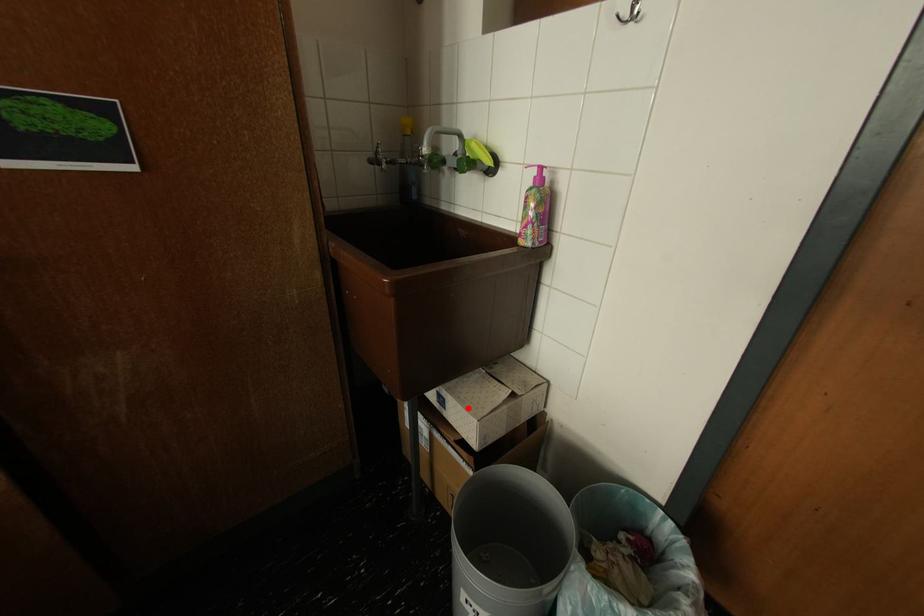
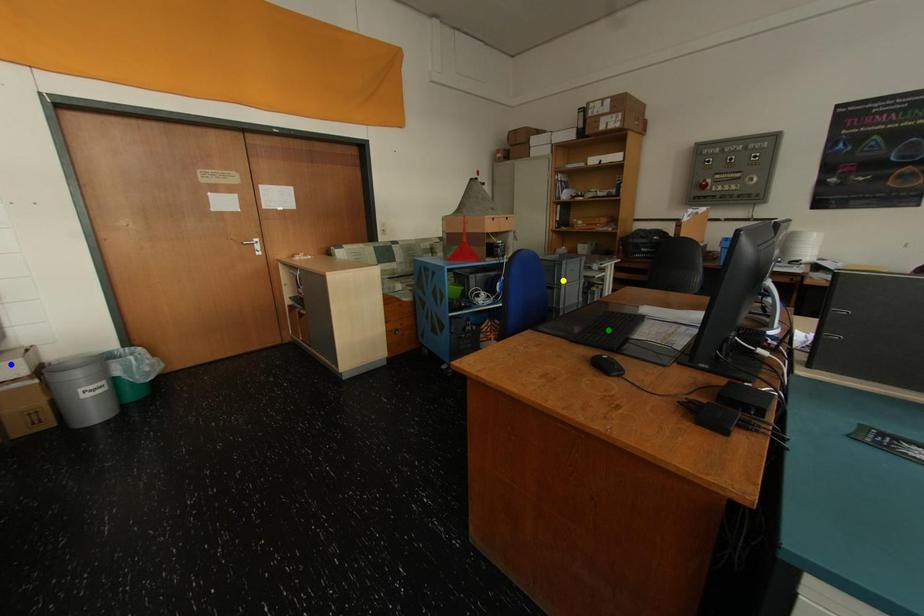
Question: I am providing you with two images of the same scene from different viewpoints. A red point is marked on the first image. You are given multiple points on the second image. Which point in image 2 is actually the same real-world point as the red point in image 1?

Choices:
 (A) green point
 (B) yellow point
 (C) blue point

Answer: (C)